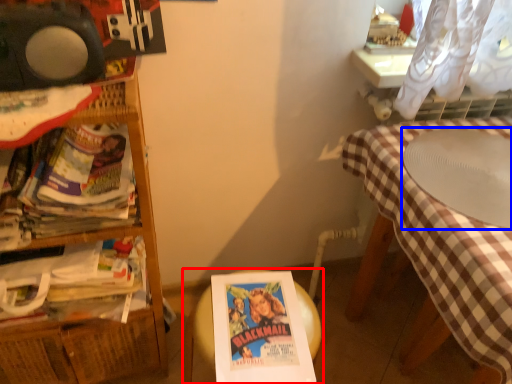
Question: Which of the following is the farthest to the observer, table (highlighted by a red box) or round table (highlighted by a blue box)?

Choices:
 (A) table
 (B) round table

Answer: (A)